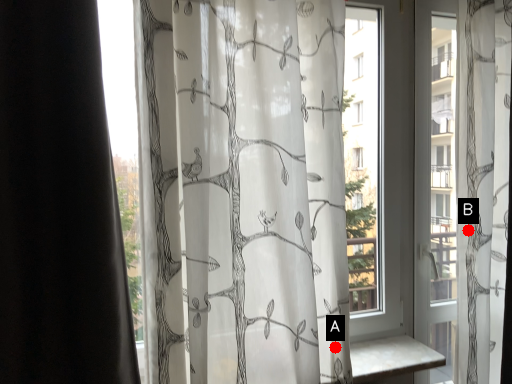
Question: Two points are circled on the image, labeled by A and B beside each circle. Which point is closer to the camera?

Choices:
 (A) A is closer
 (B) B is closer

Answer: (A)